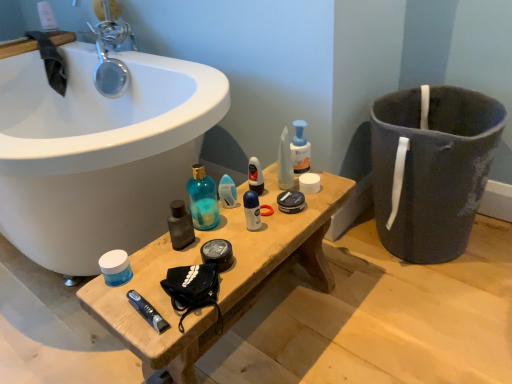
Identify the location of free space between blue matte jar at center, positioned as the 3th mouthwash in back-to-front order, and white matte deodorant at center, the 2th toiletry in the right-to-left sequence. (184, 248).